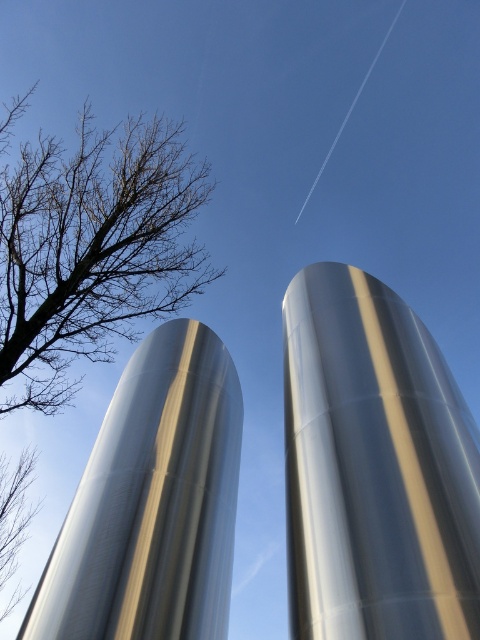
Which of these two, silver metallic rocket at center or polished metallic rocket at center, stands taller?

Standing taller between the two is polished metallic rocket at center.

Who is lower down, silver metallic rocket at center or polished metallic rocket at center?

polished metallic rocket at center is below.

Find the location of a particular element. silver metallic rocket at center is located at coordinates (374, 467).

Image resolution: width=480 pixels, height=640 pixels. What do you see at coordinates (153, 502) in the screenshot? I see `polished metallic rocket at center` at bounding box center [153, 502].

Can you confirm if polished metallic rocket at center is thinner than bare branches at left?

In fact, polished metallic rocket at center might be wider than bare branches at left.

Is point (199, 385) less distant than point (119, 211)?

Yes, point (199, 385) is in front of point (119, 211).

The image size is (480, 640). I want to click on polished metallic rocket at center, so click(x=153, y=502).

Is silver metallic rocket at center to the left of bare branches at left from the viewer's perspective?

No, silver metallic rocket at center is not to the left of bare branches at left.

Is point (314, 614) farther from viewer compared to point (116, 227)?

No, it is in front of (116, 227).

In order to click on silver metallic rocket at center in this screenshot , I will do `click(374, 467)`.